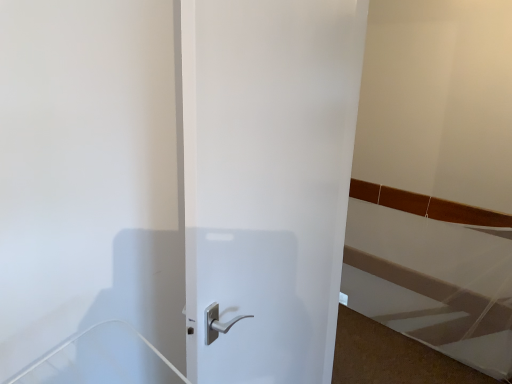
Image resolution: width=512 pixels, height=384 pixels. What are the coordinates of `white matte door at center` in the screenshot? It's located at (267, 181).

What do you see at coordinates (267, 181) in the screenshot? The height and width of the screenshot is (384, 512). I see `white matte door at center` at bounding box center [267, 181].

Image resolution: width=512 pixels, height=384 pixels. I want to click on white matte door at center, so pos(267,181).